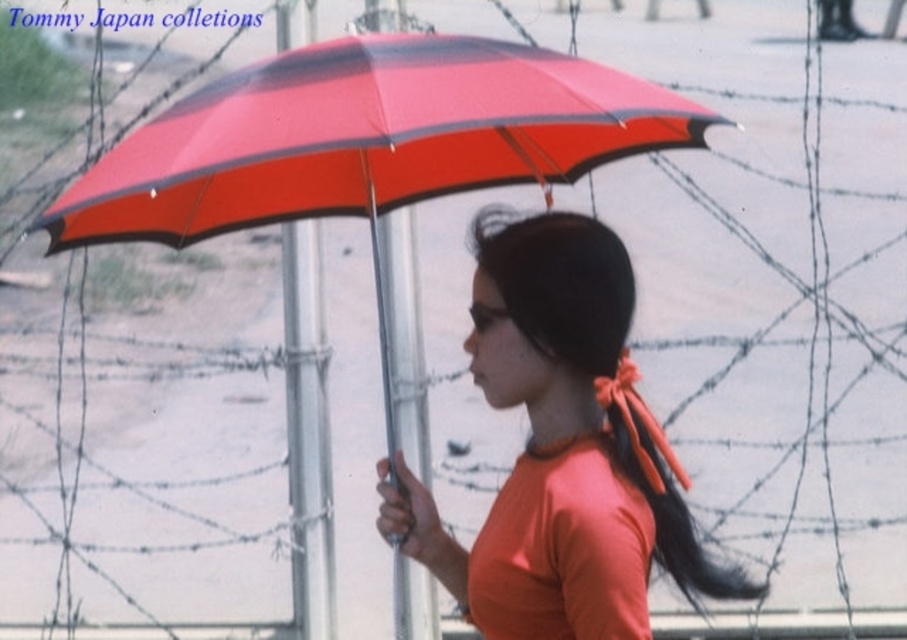
What object is located at the coordinates point (579, 384)?

The orange matte shirt at center is located at point (579, 384).

In the scene shown: You are a drone operator trying to navigate through a restricted area marked by a barbed wire fence. You have two points to consider for your flight path, point A at coordinates point [595,424] and point B at coordinates point [689,547]. Which point is closer to you as you approach the fence?

Point point [595,424] is closer to the viewer than point point [689,547], so point A is closer to you as you approach the fence.

You are a fashion designer observing the image of a person wearing an orange matte shirt at center and an orange fabric ponytail at center. Which item has a greater width?

The orange matte shirt at center has a greater width than the orange fabric ponytail at center.